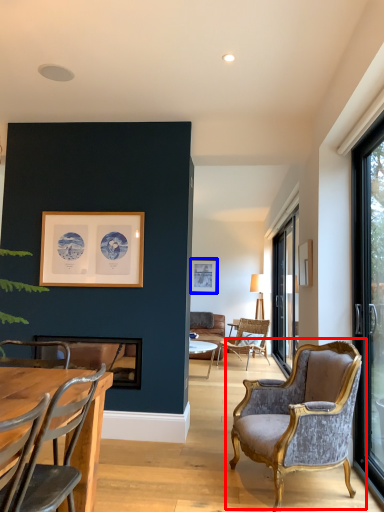
Question: Which point is closer to the camera, chair (highlighted by a red box) or picture frame (highlighted by a blue box)?

Choices:
 (A) chair
 (B) picture frame

Answer: (A)